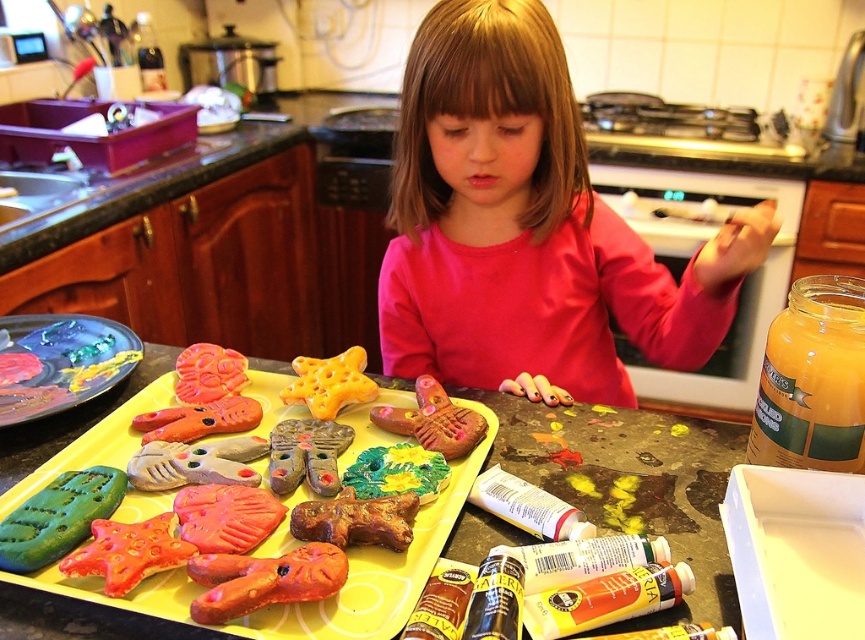
At what (x,y) coordinates should I click in order to perform the action: click on pink matte shirt at center. Please return your answer as a coordinate pair (x, y). The width and height of the screenshot is (865, 640). Looking at the image, I should click on (529, 228).

Identify the location of pink matte shirt at center. The image size is (865, 640). (529, 228).

Who is more forward, [55,396] or [427,476]?

Point [427,476]

From the picture: Can you confirm if painted ceramic plate at left is taller than green textured cookie at center?

Yes.

The width and height of the screenshot is (865, 640). Describe the element at coordinates (61, 362) in the screenshot. I see `painted ceramic plate at left` at that location.

In order to click on painted ceramic plate at left in this screenshot , I will do `click(61, 362)`.

Does matte clay cookies at center have a smaller size compared to green textured cookie at center?

Incorrect, matte clay cookies at center is not smaller in size than green textured cookie at center.

Is point (139, 388) farther from viewer compared to point (424, 458)?

That is True.

Image resolution: width=865 pixels, height=640 pixels. Describe the element at coordinates (123, 609) in the screenshot. I see `matte clay cookies at center` at that location.

I want to click on matte clay cookies at center, so click(x=123, y=609).